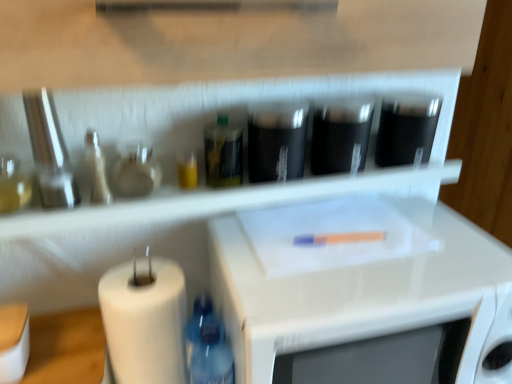
Question: Does translucent glass bottle at center, the 3th bottle ordered from the bottom, appear on the right side of blue plastic bottle at lower left, positioned as the first bottle in bottom-to-top order?

Choices:
 (A) no
 (B) yes

Answer: (B)

Question: From the image's perspective, is translucent glass bottle at center, which ranks as the first bottle in right-to-left order, below blue plastic bottle at lower left, positioned as the first bottle in bottom-to-top order?

Choices:
 (A) no
 (B) yes

Answer: (A)

Question: From a real-world perspective, is translucent glass bottle at center, which ranks as the first bottle in right-to-left order, physically below blue plastic bottle at lower left, positioned as the first bottle in bottom-to-top order?

Choices:
 (A) no
 (B) yes

Answer: (A)

Question: Is translucent glass bottle at center, placed as the third bottle when sorted from left to right, shorter than blue plastic bottle at lower left, the second bottle viewed from the right?

Choices:
 (A) no
 (B) yes

Answer: (B)

Question: Is translucent glass bottle at center, which ranks as the first bottle in right-to-left order, oriented towards blue plastic bottle at lower left, the second bottle viewed from the right?

Choices:
 (A) no
 (B) yes

Answer: (A)

Question: Is translucent glass bottle at center, which ranks as the first bottle in right-to-left order, positioned in front of blue plastic bottle at lower left, positioned as the first bottle in bottom-to-top order?

Choices:
 (A) no
 (B) yes

Answer: (A)

Question: Considering the relative positions of black matte container at upper right, which appears as the 1th appliance when viewed from the right, and metallic silver knife set at left, marked as the 1th appliance in a left-to-right arrangement, in the image provided, is black matte container at upper right, which appears as the 1th appliance when viewed from the right, to the left of metallic silver knife set at left, marked as the 1th appliance in a left-to-right arrangement, from the viewer's perspective?

Choices:
 (A) yes
 (B) no

Answer: (B)

Question: Is black matte container at upper right, which appears as the 1th appliance when viewed from the right, positioned beyond the bounds of metallic silver knife set at left, marked as the 4th appliance in a right-to-left arrangement?

Choices:
 (A) yes
 (B) no

Answer: (A)

Question: Is black matte container at upper right, placed as the 4th appliance when sorted from left to right, facing towards metallic silver knife set at left, marked as the 4th appliance in a right-to-left arrangement?

Choices:
 (A) no
 (B) yes

Answer: (A)

Question: Is black matte container at upper right, placed as the 4th appliance when sorted from left to right, shorter than metallic silver knife set at left, marked as the 4th appliance in a right-to-left arrangement?

Choices:
 (A) yes
 (B) no

Answer: (A)

Question: Is black matte container at upper right, placed as the 4th appliance when sorted from left to right, in contact with metallic silver knife set at left, marked as the 4th appliance in a right-to-left arrangement?

Choices:
 (A) no
 (B) yes

Answer: (A)

Question: From a real-world perspective, is black matte container at upper right, placed as the 4th appliance when sorted from left to right, located beneath metallic silver knife set at left, marked as the 1th appliance in a left-to-right arrangement?

Choices:
 (A) no
 (B) yes

Answer: (B)

Question: Is white matte paper towel at lower left positioned with its back to black glossy cups at center, marked as the 2th appliance in a left-to-right arrangement?

Choices:
 (A) yes
 (B) no

Answer: (B)